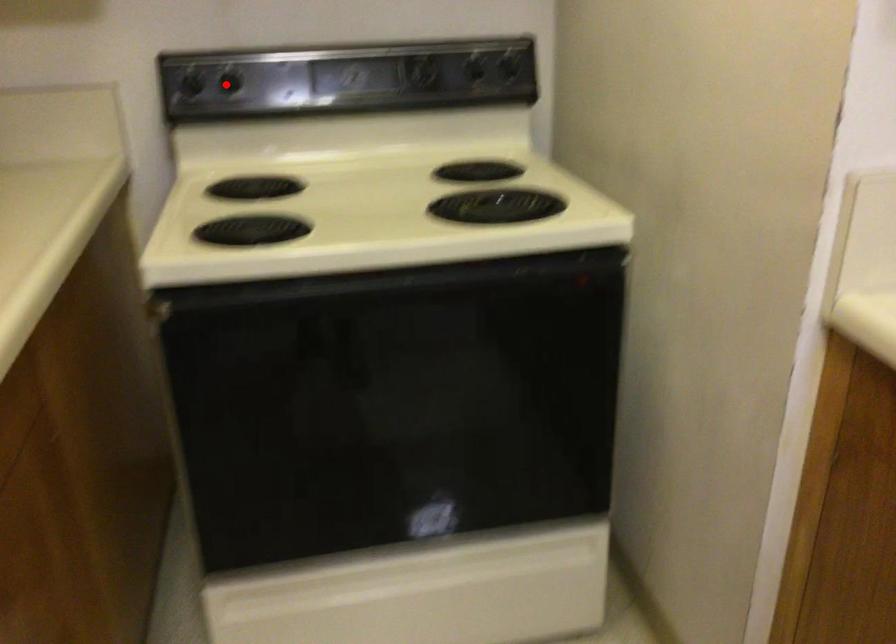
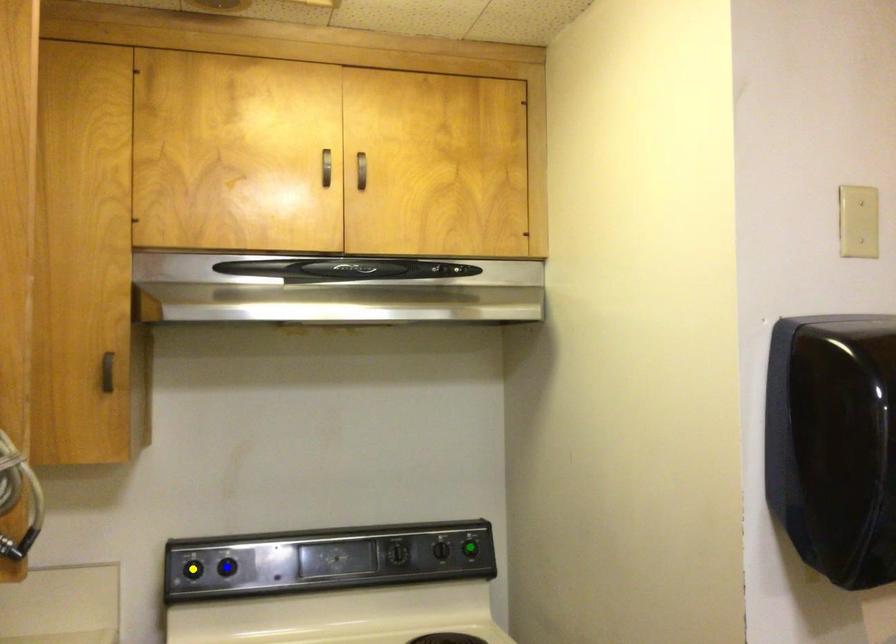
Question: I am providing you with two images of the same scene from different viewpoints. A red point is marked on the first image. You are given multiple points on the second image. Which spot in image 2 lines up with the point in image 1?

Choices:
 (A) green point
 (B) yellow point
 (C) blue point

Answer: (C)